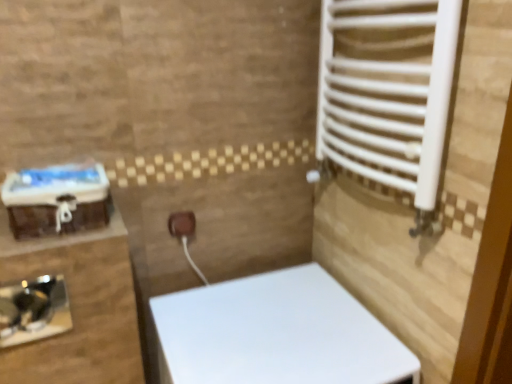
Find the location of a particular element. vacant point above white glossy toilet at center (from a real-world perspective) is located at coordinates (281, 332).